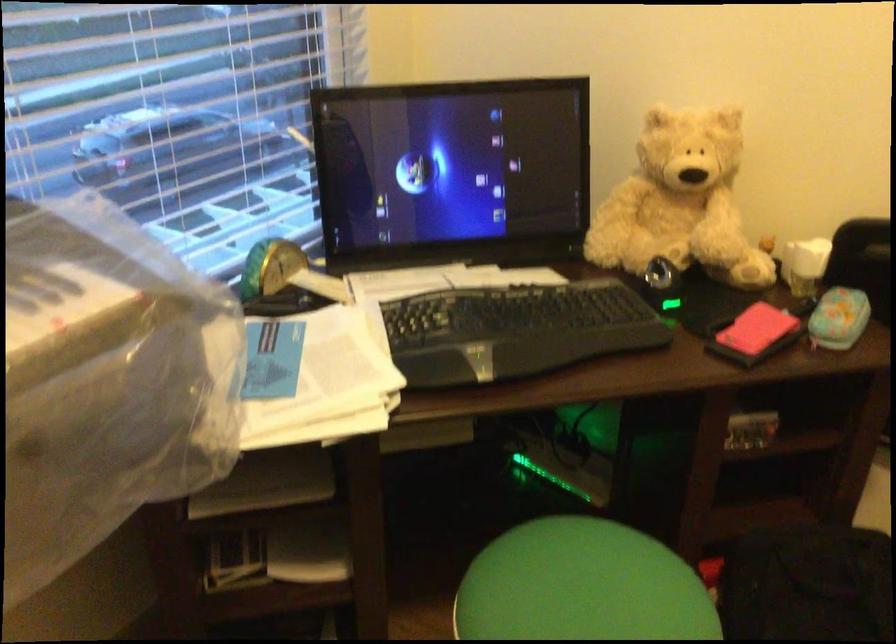
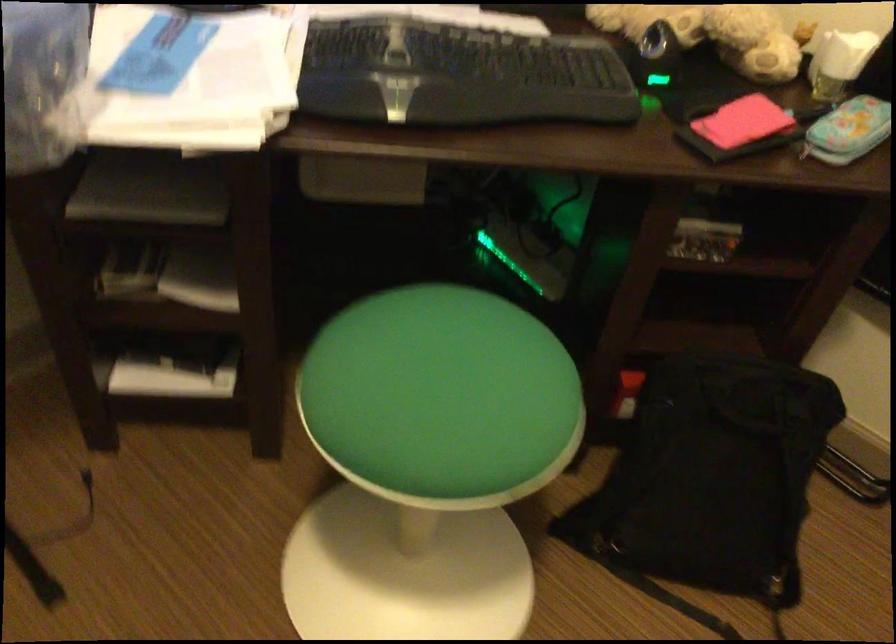
In a continuous first-person perspective shot, in which direction is the camera moving?

The movement direction of the cameraman is right, forward.